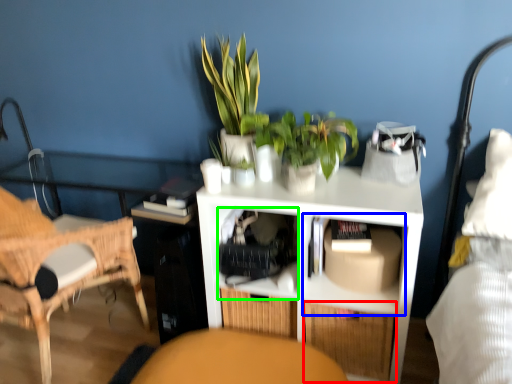
Question: Based on their relative distances, which object is farther from drawer (highlighted by a red box)? Choose from cabinet (highlighted by a blue box) and shelf (highlighted by a green box).

Choices:
 (A) cabinet
 (B) shelf

Answer: (B)